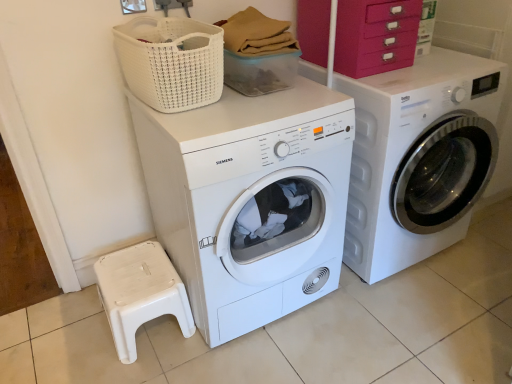
Find the location of a particular element. The width and height of the screenshot is (512, 384). vacant area that lies in front of white plastic step stool at lower left is located at coordinates (136, 369).